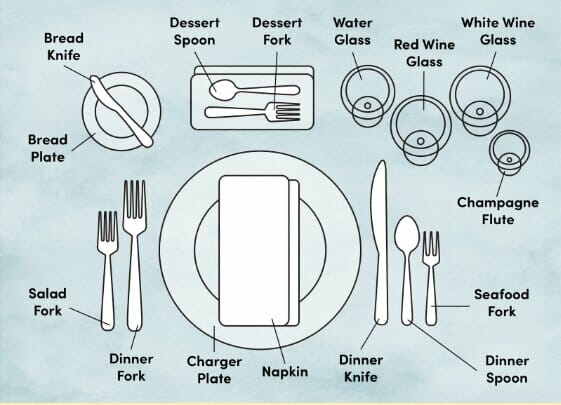
Locate an element on the screen. forks is located at coordinates (249, 116), (133, 250), (105, 271), (427, 287).